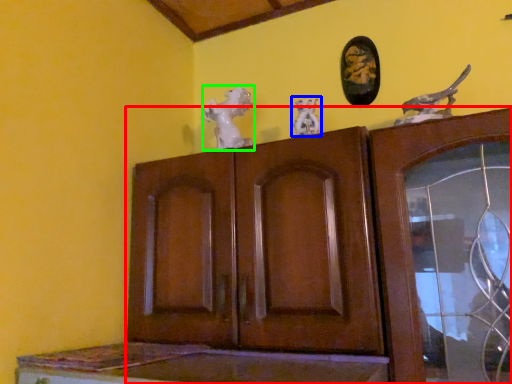
Question: Which is nearer to the cupboard (highlighted by a red box)? animal sculpture (highlighted by a blue box) or animal (highlighted by a green box).

Choices:
 (A) animal sculpture
 (B) animal

Answer: (B)